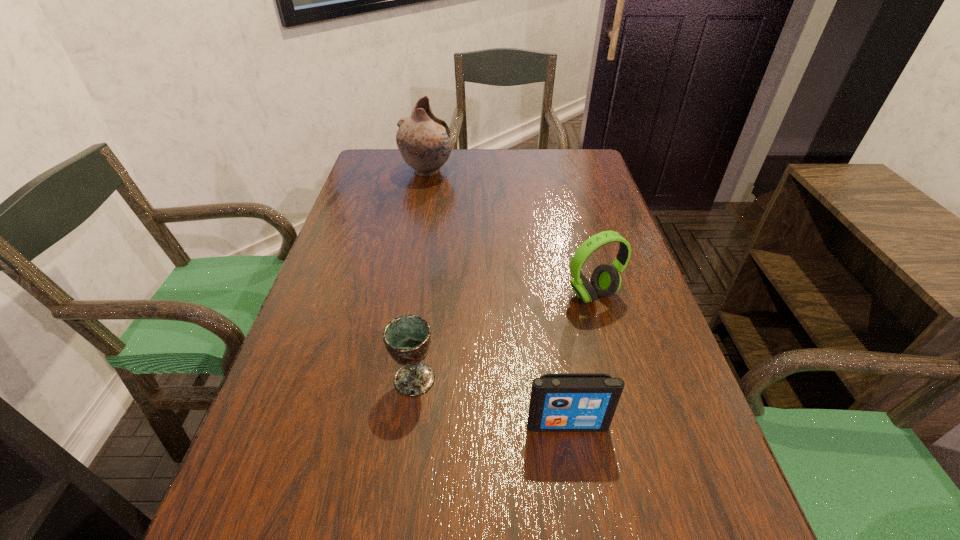
In order to click on vacant area between the headset and the farthest object in this screenshot , I will do `click(510, 233)`.

This screenshot has width=960, height=540. I want to click on vacant area that lies between the farthest object and the third shortest object, so click(510, 233).

Locate an element on the screen. The height and width of the screenshot is (540, 960). empty location between the farthest object and the headset is located at coordinates (510, 233).

The image size is (960, 540). Find the location of `free point between the chalice and the pottery`. free point between the chalice and the pottery is located at coordinates (420, 275).

Where is `free spot between the headset and the nearest object`? free spot between the headset and the nearest object is located at coordinates (580, 360).

This screenshot has width=960, height=540. In order to click on vacant area between the iPod and the tallest object in this screenshot , I will do `click(497, 298)`.

The height and width of the screenshot is (540, 960). Find the location of `free point between the farthest object and the second nearest object`. free point between the farthest object and the second nearest object is located at coordinates (420, 275).

This screenshot has height=540, width=960. I want to click on free space between the nearest object and the second farthest object, so click(580, 360).

I want to click on free spot between the iPod and the chalice, so click(x=491, y=402).

Identify the location of free space between the nearest object and the second tallest object. The width and height of the screenshot is (960, 540). (580, 360).